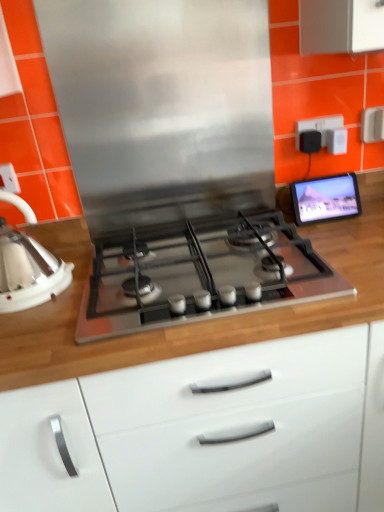
Question: Does stainless steel exhaust hood at center have a smaller size compared to matte black tablet at upper right?

Choices:
 (A) no
 (B) yes

Answer: (A)

Question: Considering the relative sizes of stainless steel exhaust hood at center and matte black tablet at upper right in the image provided, is stainless steel exhaust hood at center wider than matte black tablet at upper right?

Choices:
 (A) no
 (B) yes

Answer: (A)

Question: Considering the relative sizes of stainless steel exhaust hood at center and matte black tablet at upper right in the image provided, is stainless steel exhaust hood at center bigger than matte black tablet at upper right?

Choices:
 (A) no
 (B) yes

Answer: (B)

Question: From a real-world perspective, is stainless steel exhaust hood at center on matte black tablet at upper right?

Choices:
 (A) no
 (B) yes

Answer: (B)

Question: Is stainless steel exhaust hood at center closer to camera compared to matte black tablet at upper right?

Choices:
 (A) no
 (B) yes

Answer: (B)

Question: From the image's perspective, would you say stainless steel exhaust hood at center is shown under matte black tablet at upper right?

Choices:
 (A) no
 (B) yes

Answer: (A)

Question: Does matte black tablet at upper right appear on the left side of wooden countertop at center?

Choices:
 (A) no
 (B) yes

Answer: (A)

Question: Can you see matte black tablet at upper right touching wooden countertop at center?

Choices:
 (A) no
 (B) yes

Answer: (A)

Question: Considering the relative sizes of matte black tablet at upper right and wooden countertop at center in the image provided, is matte black tablet at upper right bigger than wooden countertop at center?

Choices:
 (A) no
 (B) yes

Answer: (A)

Question: Considering the relative sizes of matte black tablet at upper right and wooden countertop at center in the image provided, is matte black tablet at upper right thinner than wooden countertop at center?

Choices:
 (A) no
 (B) yes

Answer: (B)

Question: Considering the relative sizes of matte black tablet at upper right and wooden countertop at center in the image provided, is matte black tablet at upper right taller than wooden countertop at center?

Choices:
 (A) yes
 (B) no

Answer: (B)

Question: Considering the relative positions of matte black tablet at upper right and wooden countertop at center in the image provided, is matte black tablet at upper right to the right of wooden countertop at center from the viewer's perspective?

Choices:
 (A) no
 (B) yes

Answer: (B)

Question: Is stainless steel gas stove at center positioned with its back to white glossy kettle at left?

Choices:
 (A) yes
 (B) no

Answer: (B)